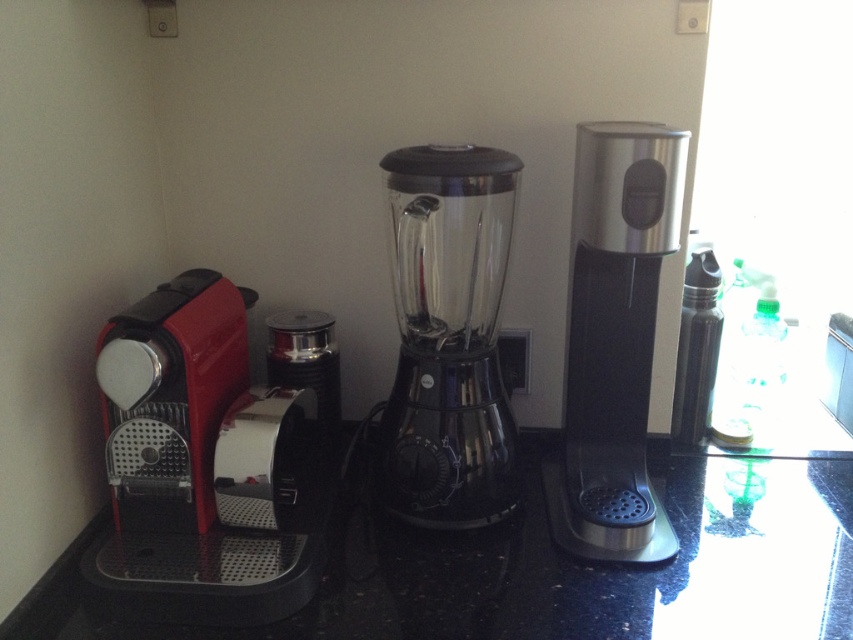
You are standing in front of the kitchen countertop and want to place a new item on the surface. There are two points marked on the countertop at coordinates point [599,632] and point [149,410]. Which point is closer to you?

Point [599,632] is closer to the viewer than point [149,410].

Consider the image. You are standing in front of the kitchen countertop. There are two points marked on the image. The first point is at coordinate (734, 477) and the second is at (502, 172). Which of these points is closer to you?

Point (734, 477) is further to the viewer than point (502, 172), so the second point at (502, 172) is closer to you.